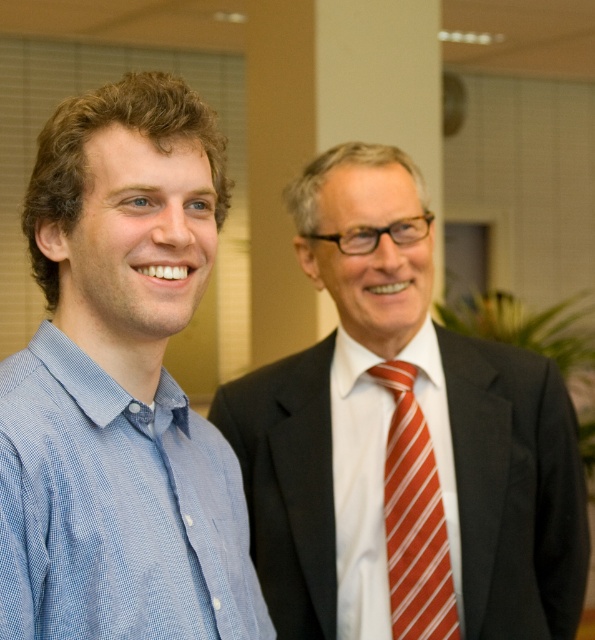
Does blue checkered shirt at left appear over matte black suit at right?

Yes.

Is point (124, 220) farther from camera compared to point (565, 500)?

That is False.

Measure the distance between blue checkered shirt at left and camera.

The distance of blue checkered shirt at left from camera is 34.89 inches.

I want to click on blue checkered shirt at left, so pyautogui.click(x=120, y=385).

Is point (192, 301) behind point (424, 497)?

That is False.

Does point (180, 515) lie in front of point (415, 458)?

Yes, it is in front of point (415, 458).

Measure the distance between blue checkered shirt at left and camera.

34.89 inches

Where is `blue checkered shirt at left`? The width and height of the screenshot is (595, 640). blue checkered shirt at left is located at coordinates (120, 385).

Based on the photo, is matte black suit at right shorter than red striped tie at center?

No.

At what (x,y) coordinates should I click in order to perform the action: click on matte black suit at right. Please return your answer as a coordinate pair (x, y). Image resolution: width=595 pixels, height=640 pixels. Looking at the image, I should click on (515, 490).

The width and height of the screenshot is (595, 640). What do you see at coordinates (515, 490) in the screenshot?
I see `matte black suit at right` at bounding box center [515, 490].

You are a GUI agent. You are given a task and a screenshot of the screen. Output one action in this format:
    pyautogui.click(x=<x>, y=<y>)
    Task: Click on the matte black suit at right
    This screenshot has height=640, width=595.
    Given the screenshot: What is the action you would take?
    pyautogui.click(x=515, y=490)